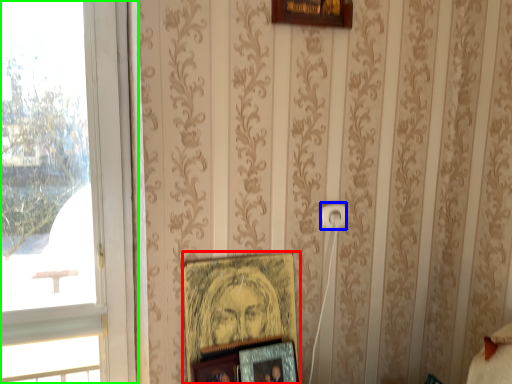
Question: Considering the real-world distances, which object is farthest from picture frame (highlighted by a red box)? electric outlet (highlighted by a blue box) or window (highlighted by a green box)?

Choices:
 (A) electric outlet
 (B) window

Answer: (B)